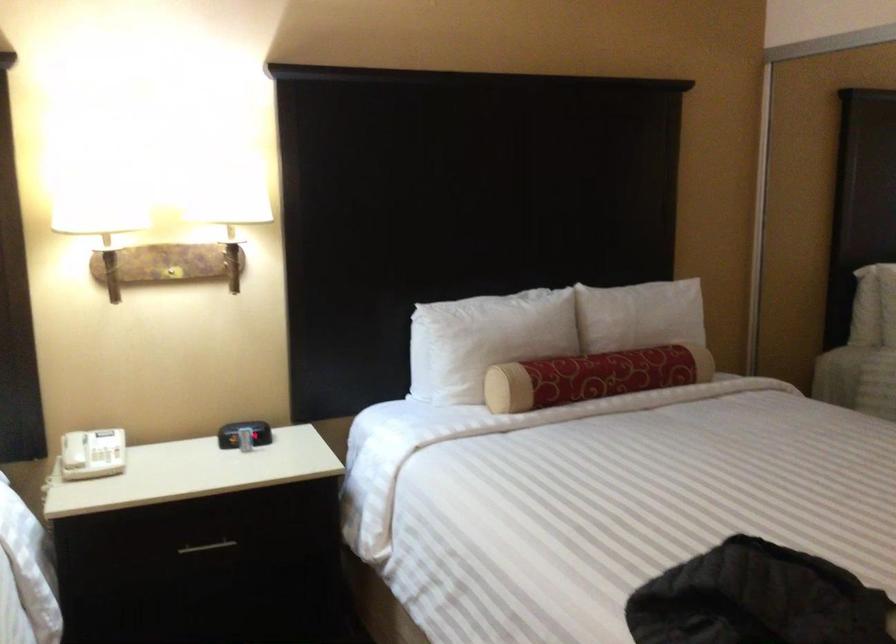
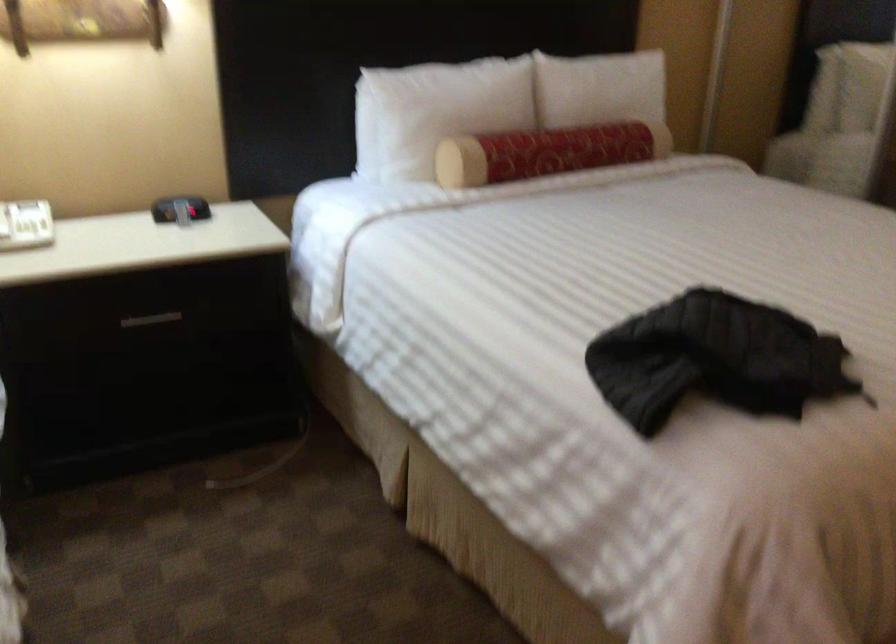
Locate, in the second image, the point that corresponds to [636,315] in the first image.

(599, 88)